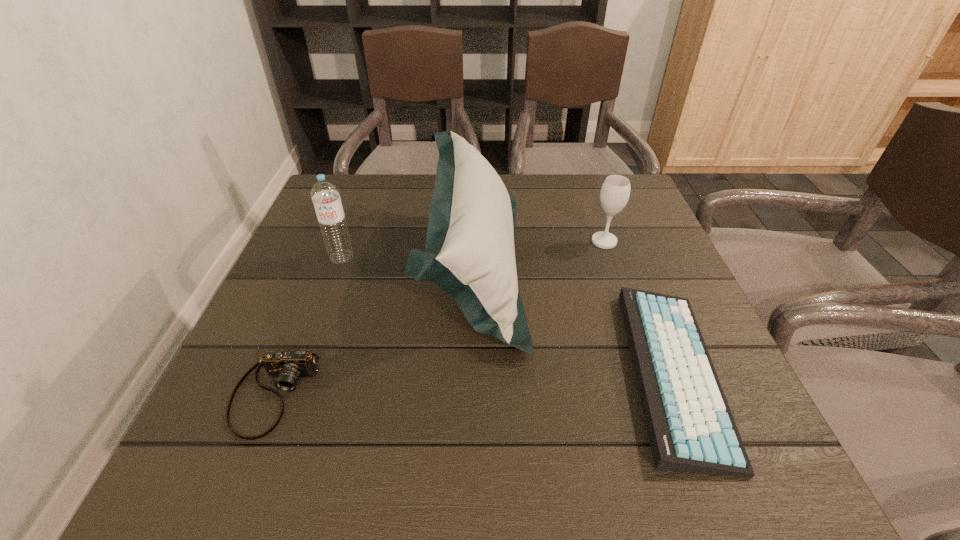
Identify the location of object that is positioned at the far edge. (469, 253).

Where is `camera that is at the near edge`? camera that is at the near edge is located at coordinates (288, 366).

The image size is (960, 540). What are the coordinates of `computer keyboard at the near edge` in the screenshot? It's located at (691, 429).

Locate an element on the screen. The width and height of the screenshot is (960, 540). water bottle present at the left edge is located at coordinates (325, 195).

The height and width of the screenshot is (540, 960). Find the location of `camera situated at the left edge`. camera situated at the left edge is located at coordinates (288, 366).

Locate an element on the screen. wineglass located in the right edge section of the desktop is located at coordinates (615, 191).

Identify the location of computer keyboard present at the right edge. coord(691,429).

The height and width of the screenshot is (540, 960). Identify the location of object located in the near left corner section of the desktop. (288, 366).

Image resolution: width=960 pixels, height=540 pixels. What are the coordinates of `object that is at the near right corner` in the screenshot? It's located at (691, 429).

Where is `vacant space at the far edge of the desktop`? vacant space at the far edge of the desktop is located at coordinates (559, 213).